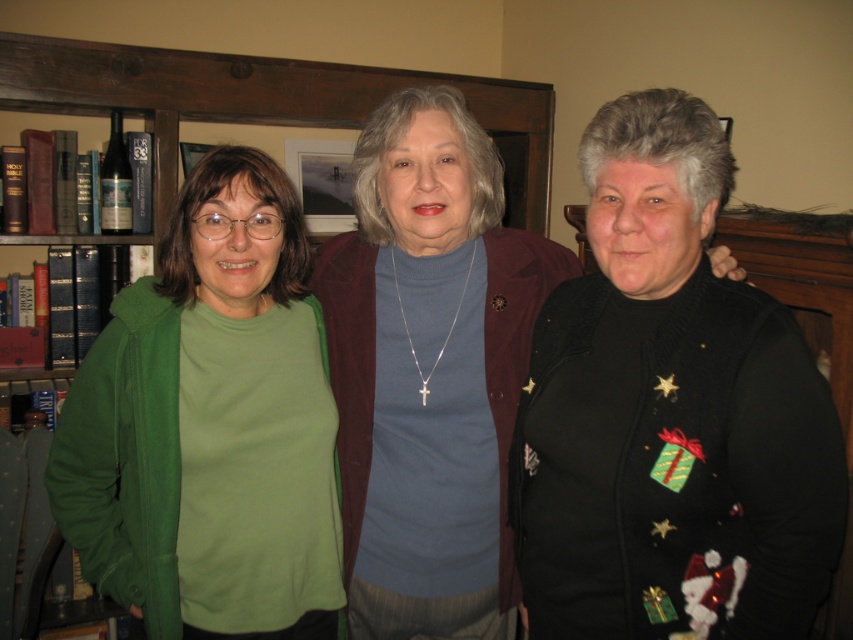
Question: Is black fuzzy sweater at right wider than wooden bookshelf at upper left?

Choices:
 (A) yes
 (B) no

Answer: (B)

Question: Which point appears farthest from the camera in this image?

Choices:
 (A) (154, 356)
 (B) (68, 109)
 (C) (584, 451)

Answer: (B)

Question: Which point is farther from the camera taking this photo?

Choices:
 (A) (592, 532)
 (B) (532, 88)

Answer: (B)

Question: Can you confirm if black fuzzy sweater at right is positioned to the left of wooden bookshelf at upper left?

Choices:
 (A) no
 (B) yes

Answer: (A)

Question: Which point appears closest to the camera in this image?

Choices:
 (A) (712, 506)
 (B) (263, 618)

Answer: (A)

Question: Is black fuzzy sweater at right to the right of wooden bookshelf at upper left from the viewer's perspective?

Choices:
 (A) yes
 (B) no

Answer: (A)